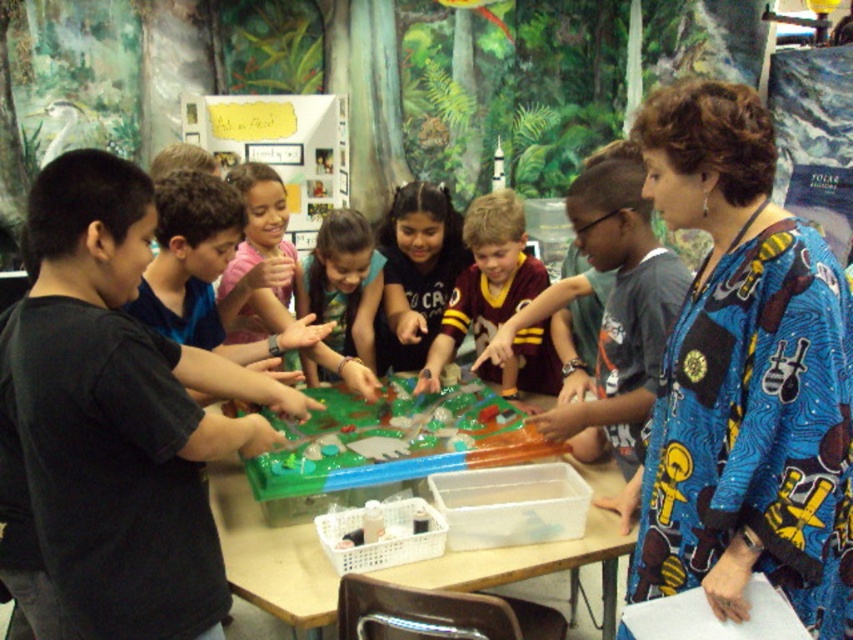
You are a student in the classroom looking at the blue printed dress at upper right and the maroon jersey at center. Which one is positioned to the right side of the other?

The blue printed dress at upper right is to the right of maroon jersey at center.

You are a student in the classroom looking at the blue printed dress at upper right and the translucent plastic board game at center. Which object is positioned to the right side of the other?

The blue printed dress at upper right is to the right of the translucent plastic board game at center.